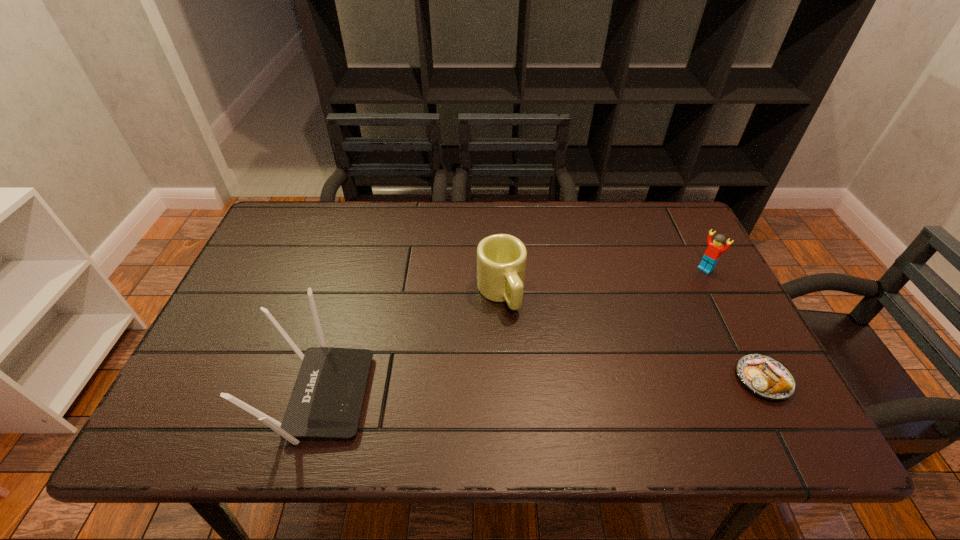
I want to click on vacant space at the right edge, so click(x=673, y=266).

Locate an element on the screen. This screenshot has height=540, width=960. vacant space at the near left corner of the desktop is located at coordinates (225, 373).

The width and height of the screenshot is (960, 540). What are the coordinates of `vacant space at the far right corner` in the screenshot? It's located at (669, 240).

Identify the location of free area in between the Lego and the mug. (603, 280).

Locate an element on the screen. blank region between the Lego and the second object from left to right is located at coordinates (603, 280).

I want to click on free space between the shortest object and the Lego, so click(x=734, y=324).

You are a GUI agent. You are given a task and a screenshot of the screen. Output one action in this format:
    pyautogui.click(x=<x>, y=<y>)
    Task: Click on the free space between the shortest object and the mug
    This screenshot has width=960, height=540.
    Given the screenshot: What is the action you would take?
    pyautogui.click(x=632, y=335)

This screenshot has height=540, width=960. Find the location of `free area in between the third object from right to left and the shortest object`. free area in between the third object from right to left and the shortest object is located at coordinates (632, 335).

I want to click on free space between the Lego and the shortest object, so click(x=734, y=324).

This screenshot has width=960, height=540. I want to click on vacant area between the shortest object and the leftmost object, so click(540, 387).